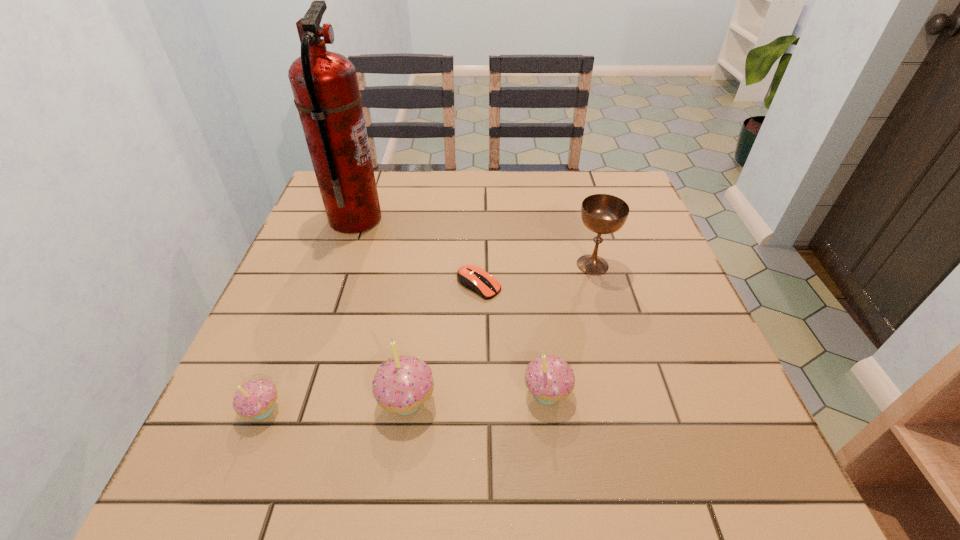
Identify the location of object that is positioned at the right edge. (601, 213).

Where is `object that is at the far left corner`? The image size is (960, 540). object that is at the far left corner is located at coordinates (326, 93).

Locate an element on the screen. Image resolution: width=960 pixels, height=540 pixels. object at the near left corner is located at coordinates (255, 399).

At what (x,y) coordinates should I click in order to perform the action: click on vacant area at the far edge. Please return your answer as a coordinate pair (x, y). This screenshot has width=960, height=540. Looking at the image, I should click on (446, 213).

At what (x,y) coordinates should I click in order to perform the action: click on free space at the near edge of the desktop. Please return your answer as a coordinate pair (x, y). The height and width of the screenshot is (540, 960). Looking at the image, I should click on (536, 401).

You are a GUI agent. You are given a task and a screenshot of the screen. Output one action in this format:
    pyautogui.click(x=<x>, y=<y>)
    Task: Click on the vacant space at the left edge of the desktop
    
    Given the screenshot: What is the action you would take?
    pyautogui.click(x=308, y=298)

The width and height of the screenshot is (960, 540). Identify the location of free space at the right edge of the desktop. (644, 273).

Where is `free spot at the far right corner of the desktop`? free spot at the far right corner of the desktop is located at coordinates (588, 178).

Locate an element on the screen. The height and width of the screenshot is (540, 960). free space that is in between the fourth object from left to right and the farthest object is located at coordinates (417, 252).

I want to click on free spot between the shortest object and the tallest object, so click(417, 252).